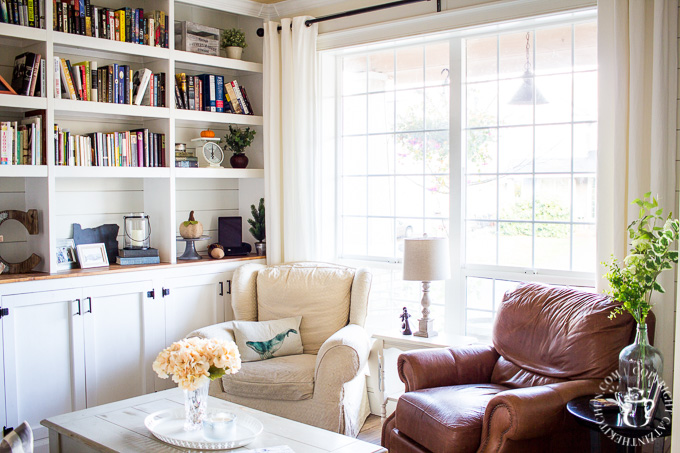
The image size is (680, 453). I want to click on orange flowers, so click(x=194, y=357).